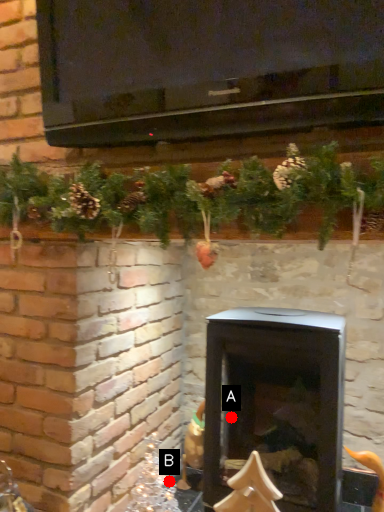
Question: Two points are circled on the image, labeled by A and B beside each circle. Which point is farther from the camera taking this photo?

Choices:
 (A) A is further
 (B) B is further

Answer: (B)